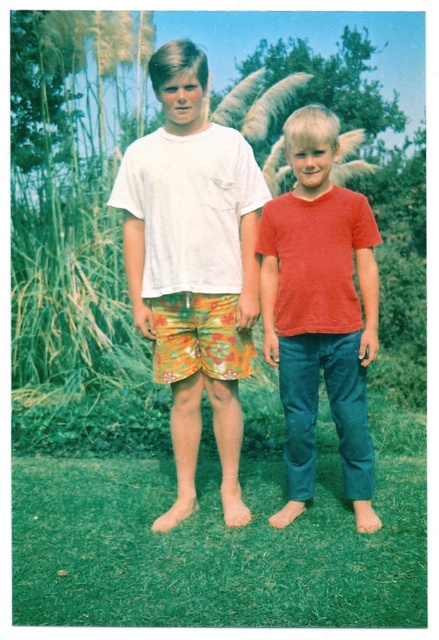
You are a photographer trying to capture a photo of both boys while ensuring their positions align with specific points in the frame. The points are labeled as point 1 at coordinates point (x=226, y=310) and point 2 at coordinates point (x=294, y=209). According to the scene, which point is positioned further away from the camera?

Point 1 at coordinates point (x=226, y=310) is positioned further away from the camera than point 2 at coordinates point (x=294, y=209).